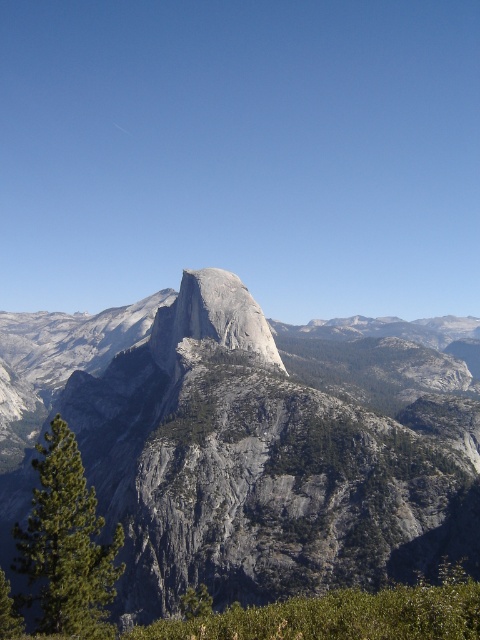
You are standing at the center of the image and looking at the green textured pine tree at lower left. What is the 2D coordinate of the pine tree in the image?

The 2D coordinate of the green textured pine tree at lower left is at point (67,545).